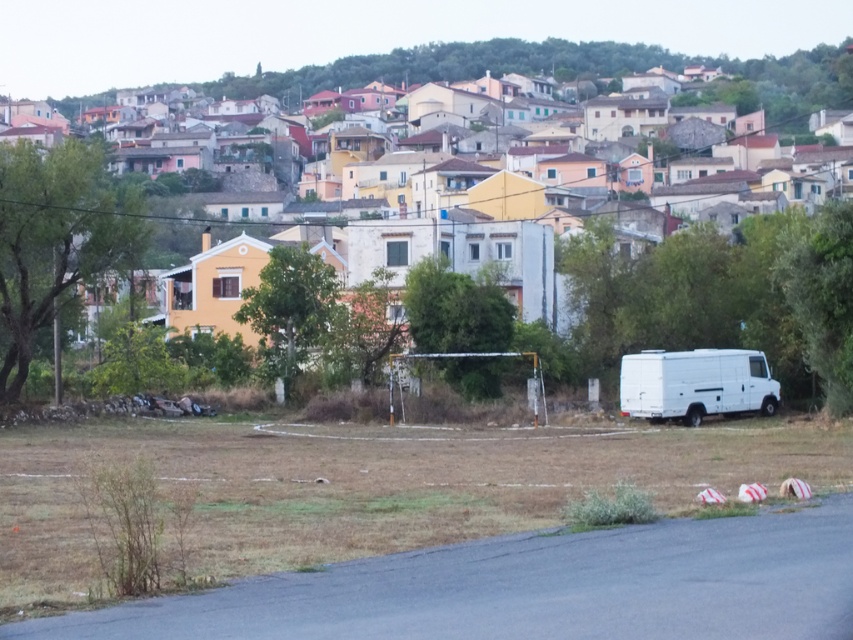
Can you confirm if white matte van at center is positioned below white matte van at right?

Incorrect, white matte van at center is not positioned below white matte van at right.

Is white matte van at center further to camera compared to white matte van at right?

No, it is not.

Is point (718, 269) positioned in front of point (689, 397)?

No, (718, 269) is behind (689, 397).

You are a GUI agent. You are given a task and a screenshot of the screen. Output one action in this format:
    pyautogui.click(x=<x>, y=<y>)
    Task: Click on the white matte van at center
    The image size is (853, 640).
    Given the screenshot: What is the action you would take?
    pyautogui.click(x=724, y=296)